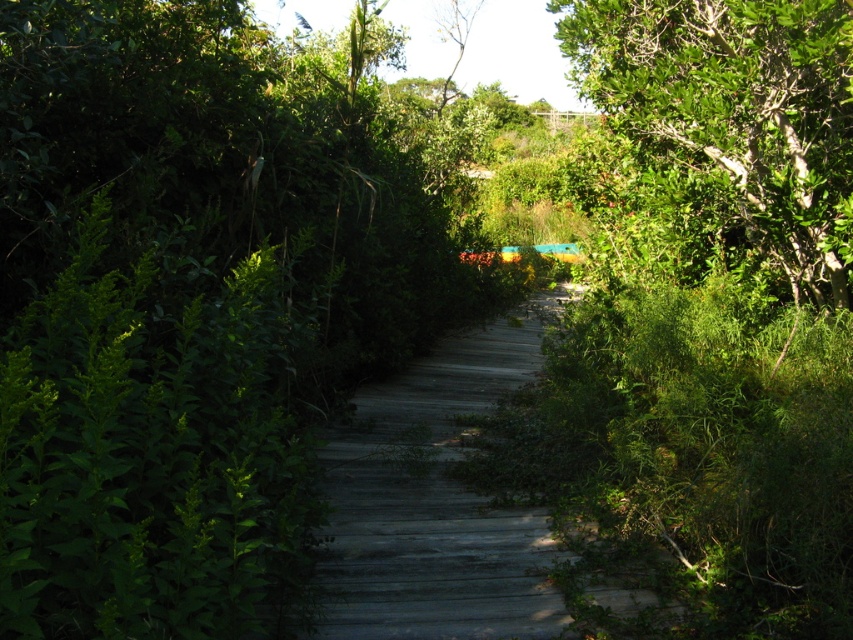
Can you confirm if green leafy tree at upper right is smaller than green leafy tree at upper center?

Actually, green leafy tree at upper right might be larger than green leafy tree at upper center.

The width and height of the screenshot is (853, 640). I want to click on green leafy tree at upper right, so click(724, 132).

Between point (531, 628) and point (462, 10), which one is positioned in front?

Point (531, 628) is more forward.

Between point (419, 480) and point (440, 20), which one is positioned behind?

The point (440, 20) is behind.

Identify the location of weathered wood trail at center. (436, 500).

Is green leafy tree at upper right closer to the viewer compared to weathered wood trail at center?

Yes, green leafy tree at upper right is closer to the viewer.

Between green leafy tree at upper right and weathered wood trail at center, which one has less height?

weathered wood trail at center

Where is `green leafy tree at upper right`? The height and width of the screenshot is (640, 853). green leafy tree at upper right is located at coordinates (724, 132).